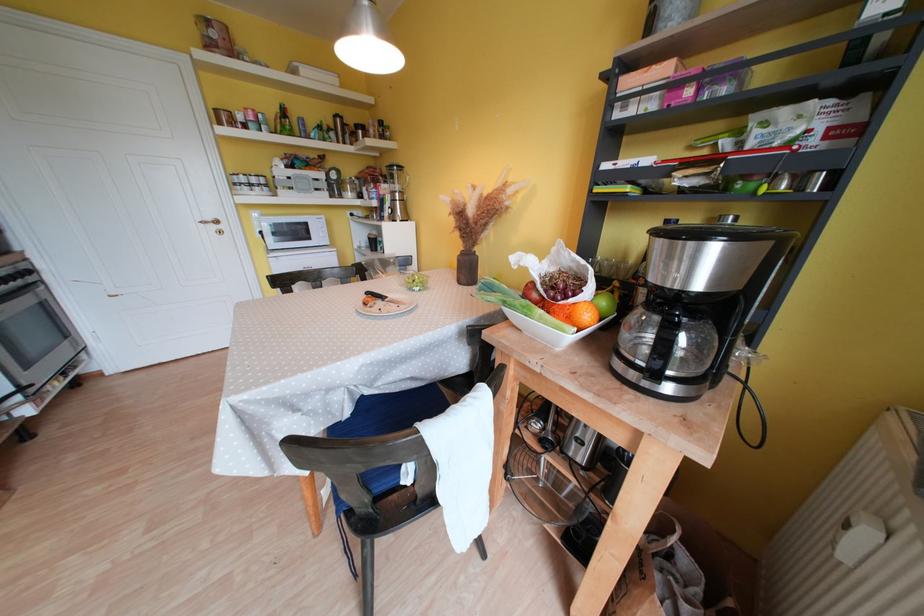
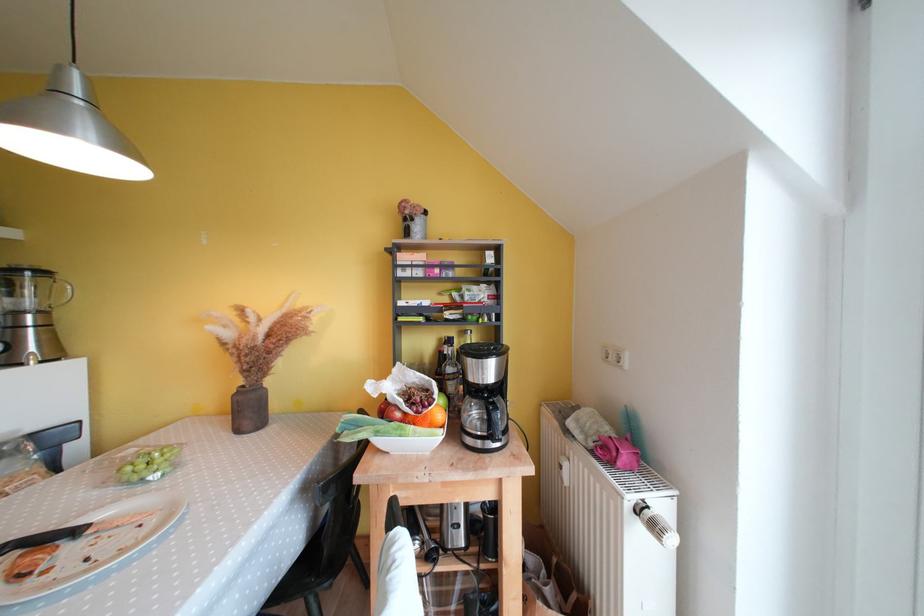
Find the pixel in the second image that matches (x=390, y=301) in the first image.

(83, 535)